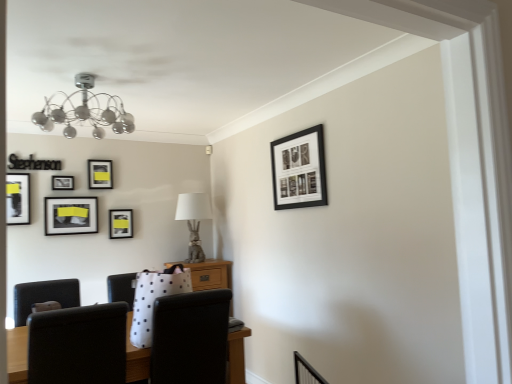
Question: In terms of height, does black fabric chair at lower center look taller or shorter compared to matte black picture frame at center left, the second picture frame from the right?

Choices:
 (A) short
 (B) tall

Answer: (B)

Question: Is point 178,365 positioned closer to the camera than point 110,231?

Choices:
 (A) closer
 (B) farther

Answer: (A)

Question: Which object is positioned farthest from the matte black picture frame at left, placed as the 4th picture frame when sorted from back to front?

Choices:
 (A) black fabric chair at lower center
 (B) matte black picture frame at center left, which ranks as the first picture frame in back-to-front order
 (C) matte black picture frame at left, the second picture frame from the front
 (D) gray stone rabbit at center
 (E) matte black picture frame at upper left, placed as the fifth picture frame when sorted from front to back

Answer: (A)

Question: Which object is the farthest from the matte black picture frame at center left, which ranks as the first picture frame in back-to-front order?

Choices:
 (A) matte black picture frame at left, positioned as the 5th picture frame in back-to-front order
 (B) matte black picture frame at upper left, which is the third picture frame from back to front
 (C) matte black picture frame at upper left, which is the third picture frame in right-to-left order
 (D) black fabric chair at lower center
 (E) matte black picture frame at left, which is the third picture frame from left to right

Answer: (D)